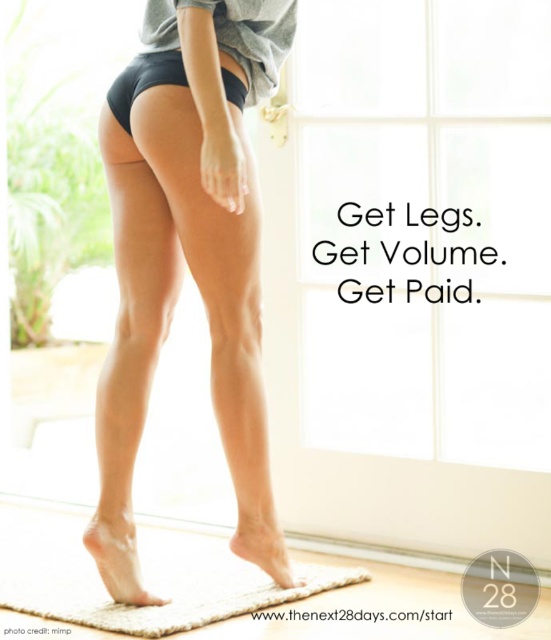
You are a photographer setting up a shoot in this room. You need to place a tripod on the floor near the beige textured yoga mat at lower center. Where should you position the tripod relative to the yoga mat?

The beige textured yoga mat at lower center is located at point (x=143, y=573), so you should position the tripod near that coordinate to place it close to the yoga mat.

You are a photographer setting up for a photoshoot. The subject is wearing smooth matte black shorts at center. You need to ensure the shorts are in focus while the background remains slightly blurred. Given the camera is positioned at a standard height, what adjustment should you make to achieve this effect?

To ensure the smooth matte black shorts at center are in focus with a blurred background, adjust the camera aperture to a wider setting, which allows more light and creates a shallower depth of field. This will keep the shorts sharp while blurring the background.